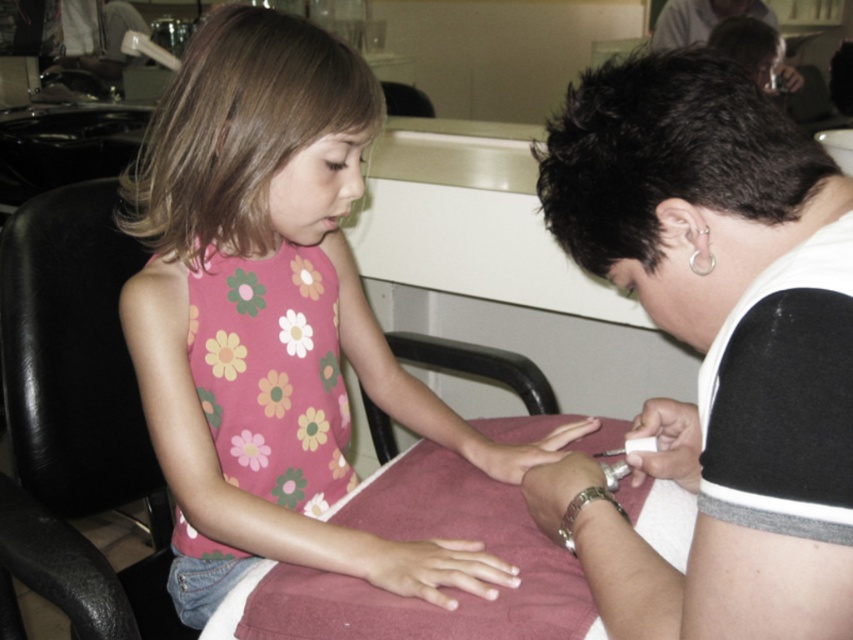
You are standing in the nail salon and want to reach the point at coordinates point [548,164]. If your arm can extend 28 inches, can you comfortably reach that point?

The point [548,164] is 28.35 inches from the viewer. Since your arm can only extend 28 inches, you cannot comfortably reach it.

You are a customer at the nail salon and want to know which point is closer to you. The points are point [744,339] and point [645,429]. Which one is closer?

Point [744,339] is in front of point [645,429], so it is closer to you.

You are a customer entering the nail salon and want to sit on the black leather chair at left. However, there is a smooth skin hand at center in your way. Can you walk directly to the chair without moving the hand?

The black leather chair at left is closer to the viewer than the smooth skin hand at center, so you can walk directly to the black leather chair at left without needing to move the hand because the chair is nearer to you.